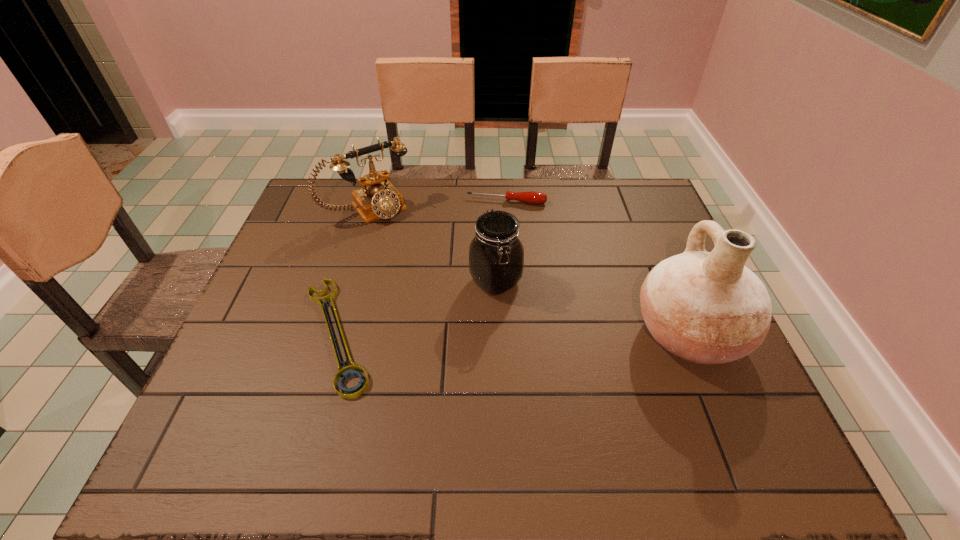
Find the location of a particular element. free space on the desktop that is between the shortest object and the tallest object and is positioned on the dial number of the telephone is located at coordinates (468, 334).

This screenshot has height=540, width=960. Find the location of `free spot on the desktop that is between the wrench and the pottery and is positioned at the tip of the fourth tallest object`. free spot on the desktop that is between the wrench and the pottery and is positioned at the tip of the fourth tallest object is located at coordinates (486, 334).

This screenshot has width=960, height=540. Identify the location of free spot on the desktop that is between the shortest object and the tallest object and is positioned on the lid of the jar. (557, 334).